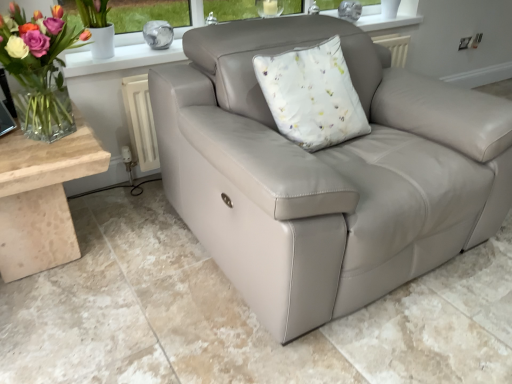
Question: In the image, is beige marble table at lower left positioned in front of or behind matte leather couch at center?

Choices:
 (A) behind
 (B) front

Answer: (A)

Question: In terms of size, does beige marble table at lower left appear bigger or smaller than matte leather couch at center?

Choices:
 (A) small
 (B) big

Answer: (A)

Question: Considering the real-world distances, which object is farthest from the matte leather couch at center?

Choices:
 (A) beige marble table at lower left
 (B) clear glass vase at left

Answer: (B)

Question: Considering the real-world distances, which object is closest to the beige marble table at lower left?

Choices:
 (A) matte leather couch at center
 (B) clear glass vase at left

Answer: (B)